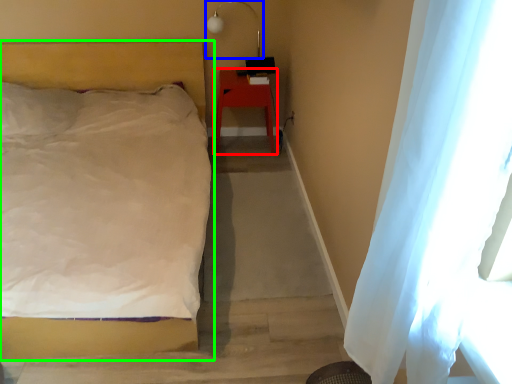
Question: Which object is the farthest from furniture (highlighted by a red box)? Choose among these: lamp (highlighted by a blue box) or bed (highlighted by a green box).

Choices:
 (A) lamp
 (B) bed

Answer: (B)